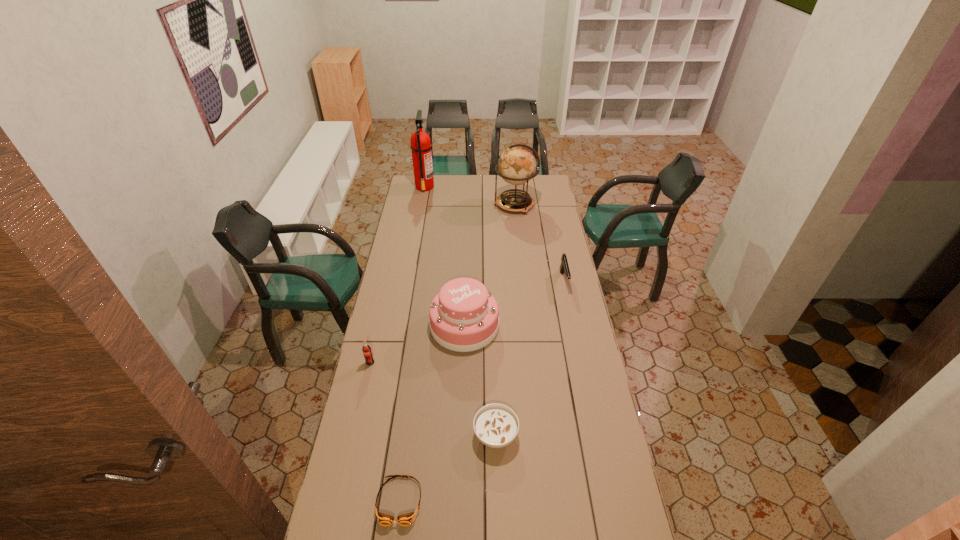
Locate an element on the screen. fire extinguisher is located at coordinates (420, 146).

This screenshot has height=540, width=960. I want to click on globe, so click(x=517, y=165).

Where is `the fifth shortest object`? the fifth shortest object is located at coordinates (464, 317).

You are a GUI agent. You are given a task and a screenshot of the screen. Output one action in this format:
    pyautogui.click(x=<x>, y=<y>)
    Task: Click on the fourth nearest object
    This screenshot has height=540, width=960.
    Given the screenshot: What is the action you would take?
    pyautogui.click(x=464, y=317)

The height and width of the screenshot is (540, 960). I want to click on the fourth tallest object, so click(x=366, y=349).

Where is `the third nearest object`? the third nearest object is located at coordinates (366, 349).

Identify the location of the third farthest object. This screenshot has width=960, height=540. (564, 267).

You are a GUI agent. You are given a task and a screenshot of the screen. Output one action in this format:
    pyautogui.click(x=<x>, y=<y>)
    Task: Click on the fifth tallest object
    
    Given the screenshot: What is the action you would take?
    pyautogui.click(x=564, y=267)

Image resolution: width=960 pixels, height=540 pixels. I want to click on soup bowl, so click(496, 425).

The height and width of the screenshot is (540, 960). What are the coordinates of `the second nearest object` in the screenshot? It's located at (496, 425).